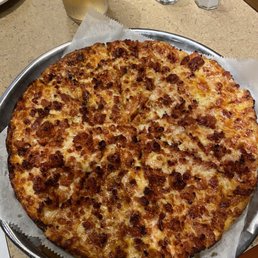
You are a GUI agent. You are given a task and a screenshot of the screen. Output one action in this format:
    pyautogui.click(x=<x>, y=<y>)
    Task: Click on the wooden spoon hlder
    The height and width of the screenshot is (258, 258).
    Given the screenshot: What is the action you would take?
    pyautogui.click(x=74, y=10)